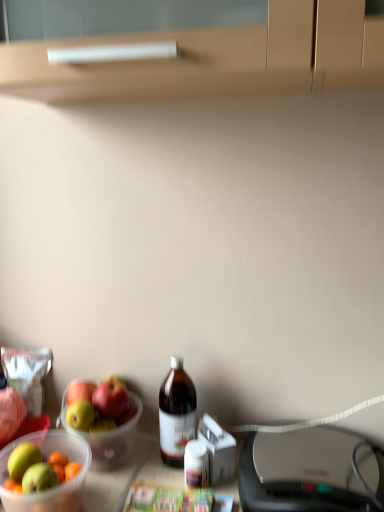
Question: Is brown glass bottle at center outside translucent plastic bowl at lower left?

Choices:
 (A) yes
 (B) no

Answer: (A)

Question: From the image's perspective, would you say brown glass bottle at center is positioned over translucent plastic bowl at lower left?

Choices:
 (A) no
 (B) yes

Answer: (B)

Question: Is there a large distance between brown glass bottle at center and translucent plastic bowl at lower left?

Choices:
 (A) no
 (B) yes

Answer: (A)

Question: Is brown glass bottle at center directly adjacent to translucent plastic bowl at lower left?

Choices:
 (A) no
 (B) yes

Answer: (A)

Question: From the image's perspective, is brown glass bottle at center under translucent plastic bowl at lower left?

Choices:
 (A) yes
 (B) no

Answer: (B)

Question: Is matte black printer at lower right wider or thinner than translucent plastic bowl at lower left?

Choices:
 (A) wide
 (B) thin

Answer: (A)

Question: From the image's perspective, is matte black printer at lower right above or below translucent plastic bowl at lower left?

Choices:
 (A) above
 (B) below

Answer: (B)

Question: From a real-world perspective, relative to translucent plastic bowl at lower left, is matte black printer at lower right vertically above or below?

Choices:
 (A) below
 (B) above

Answer: (A)

Question: Is matte black printer at lower right to the left or to the right of translucent plastic bowl at lower left in the image?

Choices:
 (A) left
 (B) right

Answer: (B)

Question: From the image's perspective, is matte black printer at lower right positioned above or below brown glass bottle at center?

Choices:
 (A) above
 (B) below

Answer: (B)

Question: Considering the positions of matte black printer at lower right and brown glass bottle at center in the image, is matte black printer at lower right wider or thinner than brown glass bottle at center?

Choices:
 (A) wide
 (B) thin

Answer: (A)

Question: Considering the positions of point (354, 494) and point (195, 396), is point (354, 494) closer or farther from the camera than point (195, 396)?

Choices:
 (A) closer
 (B) farther

Answer: (A)

Question: Is matte black printer at lower right situated inside brown glass bottle at center or outside?

Choices:
 (A) outside
 (B) inside

Answer: (A)

Question: Considering their positions, is translucent plastic bowl at lower left located in front of or behind matte black printer at lower right?

Choices:
 (A) behind
 (B) front

Answer: (A)

Question: From a real-world perspective, is translucent plastic bowl at lower left physically located above or below matte black printer at lower right?

Choices:
 (A) below
 (B) above

Answer: (B)